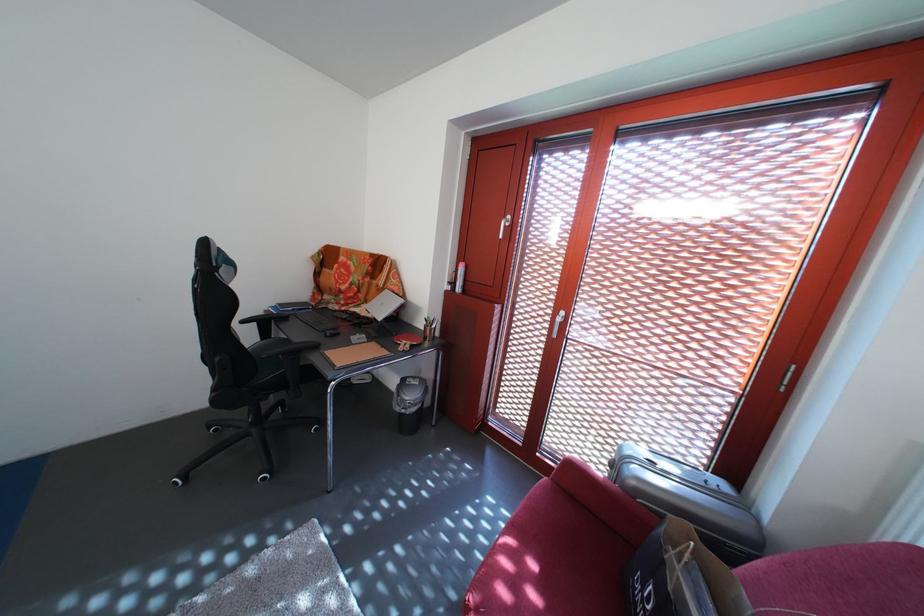
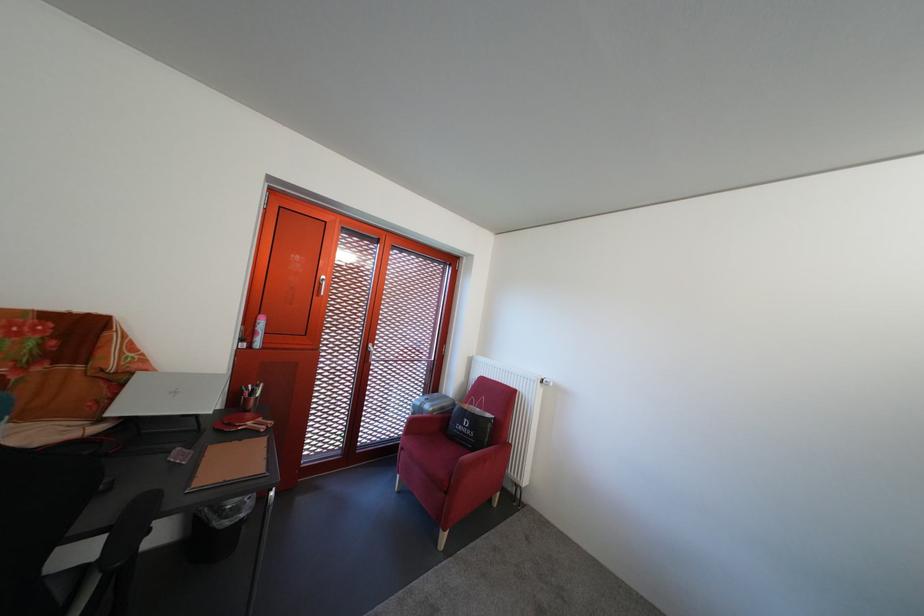
The point at (408, 416) is marked in the first image. Where is the corresponding point in the second image?

(237, 530)